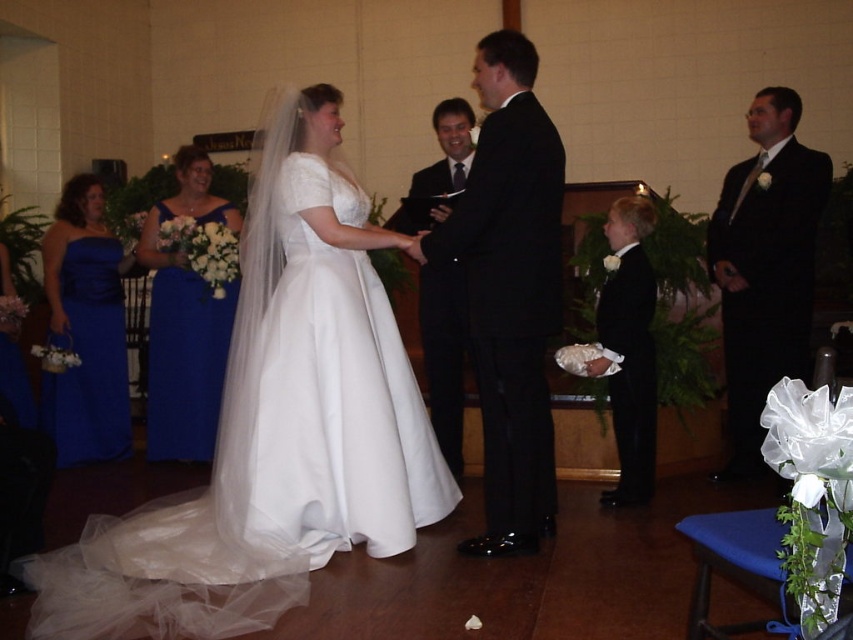
Does blue satin dress at left have a greater height compared to black satin suit at lower right?

Yes, blue satin dress at left is taller than black satin suit at lower right.

The width and height of the screenshot is (853, 640). I want to click on blue satin dress at left, so pyautogui.click(x=85, y=328).

Does point (74, 266) come behind point (647, 269)?

That is True.

Where is `blue satin dress at left`? This screenshot has width=853, height=640. blue satin dress at left is located at coordinates click(x=85, y=328).

Which is behind, point (515, 173) or point (727, 468)?

Point (727, 468)

Between shiny black suit at center and black satin suit at right, which one is positioned lower?

shiny black suit at center is below.

This screenshot has width=853, height=640. Describe the element at coordinates (509, 289) in the screenshot. I see `shiny black suit at center` at that location.

You are a GUI agent. You are given a task and a screenshot of the screen. Output one action in this format:
    pyautogui.click(x=<x>, y=<y>)
    Task: Click on the shiny black suit at center
    The height and width of the screenshot is (640, 853).
    Given the screenshot: What is the action you would take?
    pyautogui.click(x=509, y=289)

Between point (323, 532) and point (425, 301), which one is positioned behind?

Positioned behind is point (425, 301).

The width and height of the screenshot is (853, 640). In order to click on white satin dress at center in this screenshot , I will do `click(276, 426)`.

Find the location of a particular element. white satin dress at center is located at coordinates (276, 426).